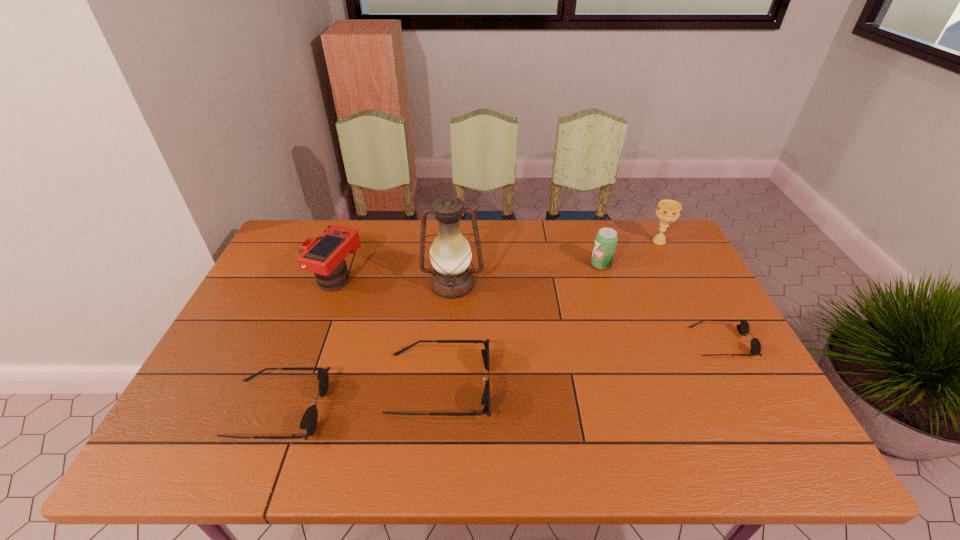
Where is `free space for an extra sunglasses to achieve even spacing`? The height and width of the screenshot is (540, 960). free space for an extra sunglasses to achieve even spacing is located at coordinates (587, 363).